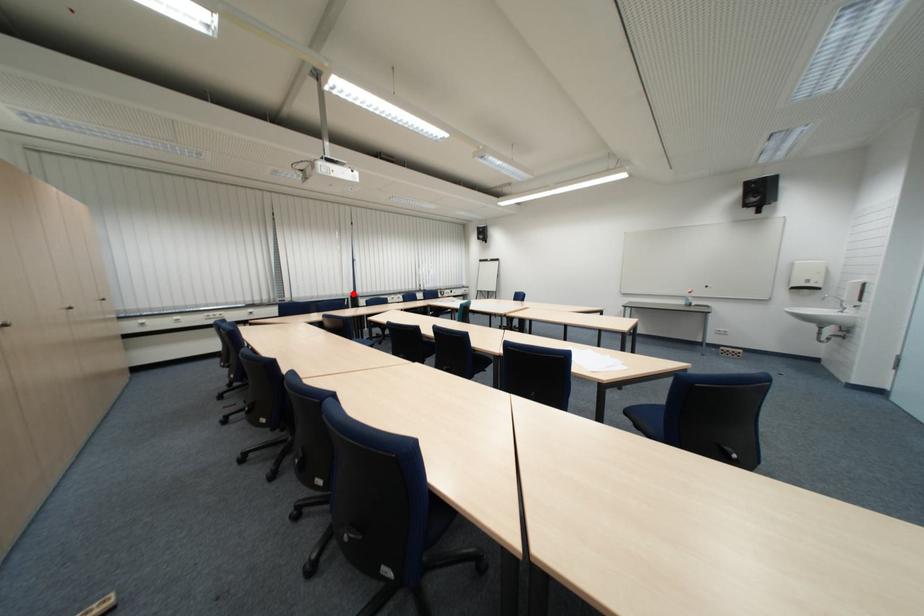
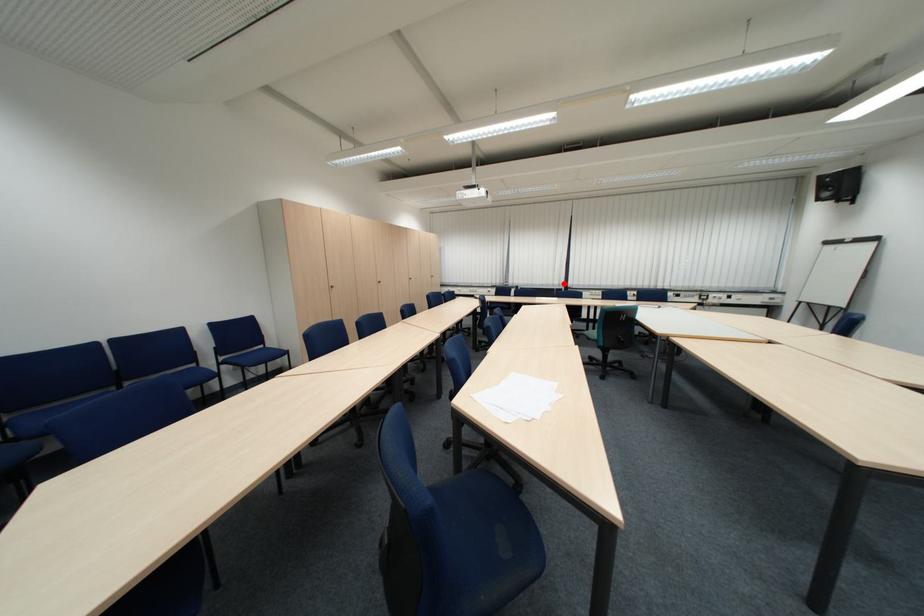
I am providing you with two images of the same scene from different viewpoints. A red point is marked on the first image and another point is marked on the second image. Are the points marked in image1 and image2 representing the same 3D position?

Yes